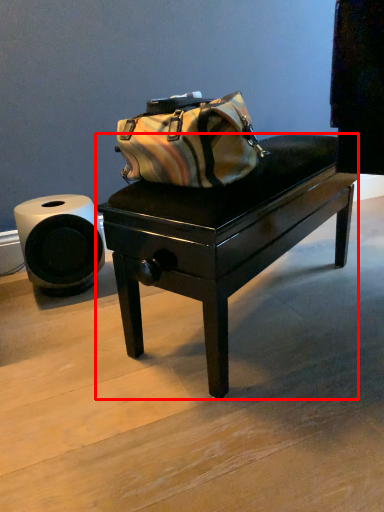
Question: From the image's perspective, where is table (annotated by the red box) located relative to toilet paper?

Choices:
 (A) below
 (B) above

Answer: (B)